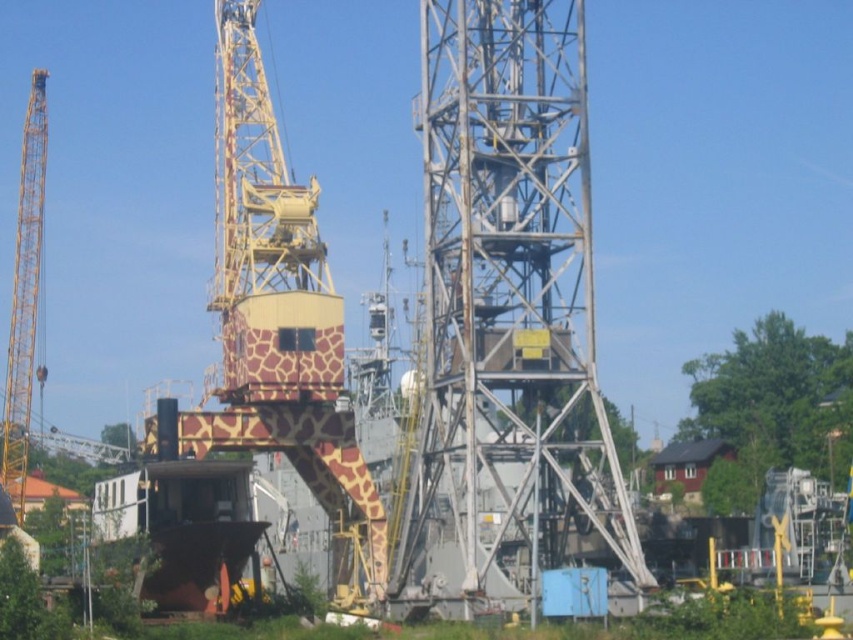
You are an engineer inspecting the industrial site. You notice the yellow metallic crane at left and the blue painted metal lift at center. Which one is located above the other?

The yellow metallic crane at left is positioned over the blue painted metal lift at center.

You are an engineer assessing the layout of a construction site. You need to determine if the yellow metallic crane at left can fit through a narrow passage that is only wide enough for the blue painted metal lift at center. Based on their sizes, what would you advise?

The yellow metallic crane at left is wider than the blue painted metal lift at center. Therefore, the yellow metallic crane at left may not fit through the narrow passage designed for the blue painted metal lift at center.

You are an engineer planning to move a heavy load from the yellow metallic crane at left to the blue painted metal lift at center. The load requires a clear path of at least 60 meters between the two. Can the load be safely transported between them?

The distance between the yellow metallic crane at left and the blue painted metal lift at center is 63.53 meters, which exceeds the required 60 meters. Therefore, the load can be safely transported between them.